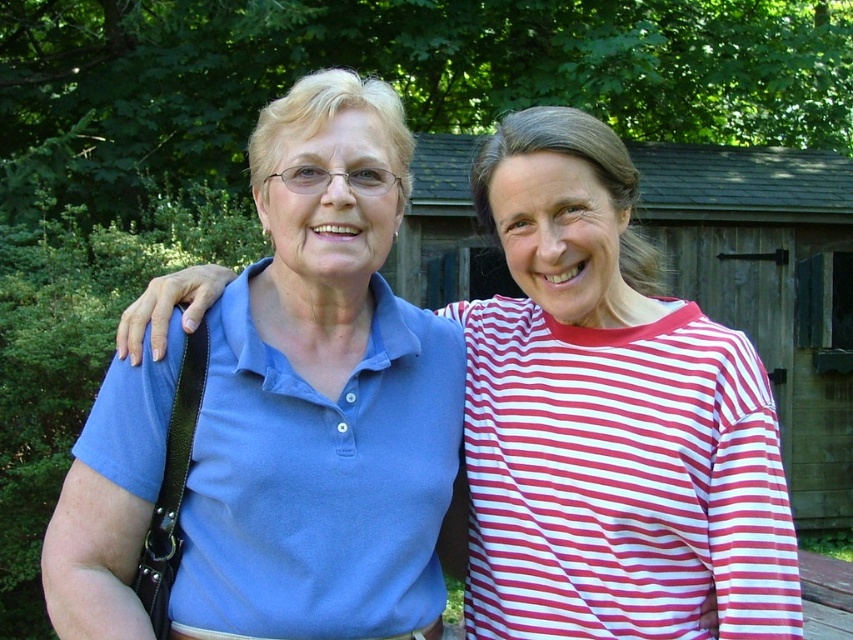
You are a photographer trying to capture a closeup of the blue cotton polo shirt at center and the matte blue polo shirt at center. Since both are at the center, which one should you focus on first if you want to capture the one closer to the left side?

The matte blue polo shirt at center is to the left of the blue cotton polo shirt at center, so you should focus on the matte blue polo shirt at center first to capture the one closer to the left side.

You are a photographer trying to capture a candid shot of the two people in the image. The red striped shirt at right and the matte blue polo shirt at center are your subjects. Based on their positions, which subject is positioned lower in the frame?

The red striped shirt at right is located below matte blue polo shirt at center, so the red striped shirt at right is positioned lower in the frame.

You are a tailor measuring shirts for alterations. You have a customer who wants to know if their blue cotton polo shirt at center can be shortened to match the height of their red striped shirt at right. Based on the image, what advice would you give?

The blue cotton polo shirt at center is taller than the red striped shirt at right. To match their heights, you should shorten the blue cotton polo shirt at center by the difference in their current heights.